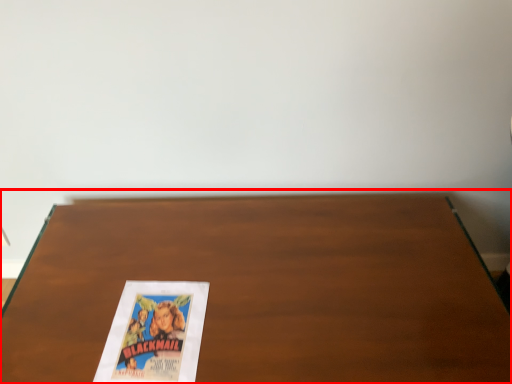
Question: Where is table (annotated by the red box) located in relation to paperback book in the image?

Choices:
 (A) right
 (B) left

Answer: (A)